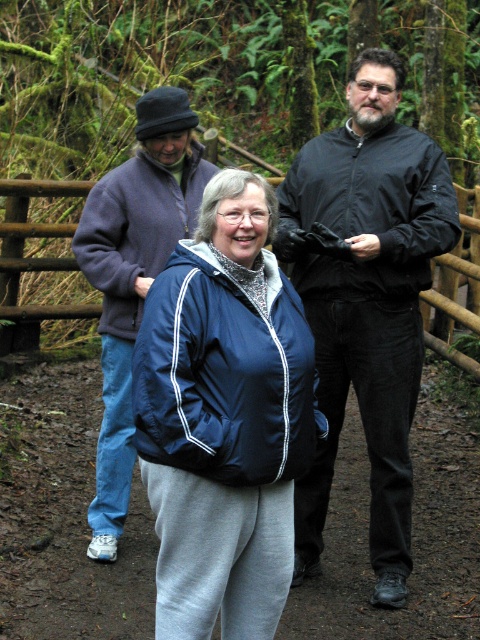
Between blue fleece jacket at center and wooden fence at center, which one has more height?

Standing taller between the two is blue fleece jacket at center.

Which is above, blue fleece jacket at center or wooden fence at center?

wooden fence at center

I want to click on blue fleece jacket at center, so click(x=133, y=276).

From the picture: Does black matte jacket at center appear under blue fleece jacket at center?

Yes.

Is point (363, 417) farther from camera compared to point (181, 134)?

No, it is in front of (181, 134).

Locate an element on the screen. The width and height of the screenshot is (480, 640). black matte jacket at center is located at coordinates (367, 300).

Does navy blue jacket at center appear under black matte jacket at center?

→ Indeed, navy blue jacket at center is positioned under black matte jacket at center.

Which of these two, navy blue jacket at center or black matte jacket at center, stands taller?

With more height is black matte jacket at center.

Identify the location of navy blue jacket at center. (224, 417).